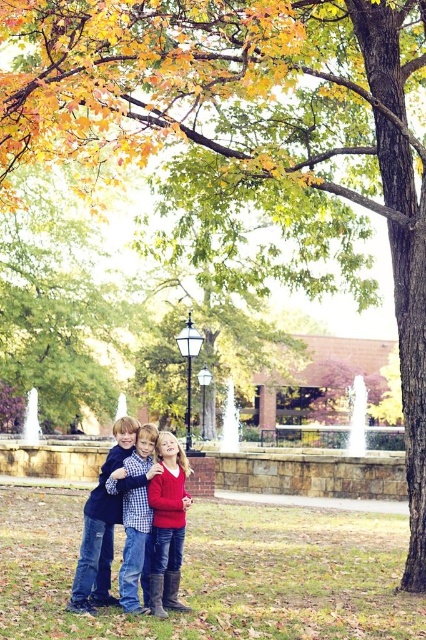
Question: Which of the following is the closest to the observer?

Choices:
 (A) checkered fabric shirt at center
 (B) denim jeans at center
 (C) matte red sweater at center

Answer: (A)

Question: Can you confirm if denim jeans at center is positioned below matte red sweater at center?

Choices:
 (A) no
 (B) yes

Answer: (B)

Question: Can you confirm if matte red sweater at center is positioned below checkered fabric shirt at center?

Choices:
 (A) no
 (B) yes

Answer: (A)

Question: Considering the relative positions of matte red sweater at center and checkered fabric shirt at center in the image provided, where is matte red sweater at center located with respect to checkered fabric shirt at center?

Choices:
 (A) above
 (B) below

Answer: (A)

Question: Estimate the real-world distances between objects in this image. Which object is closer to the denim jeans at center?

Choices:
 (A) checkered fabric shirt at center
 (B) matte red sweater at center

Answer: (A)

Question: Which object is closer to the camera taking this photo?

Choices:
 (A) denim jeans at center
 (B) checkered fabric shirt at center

Answer: (B)